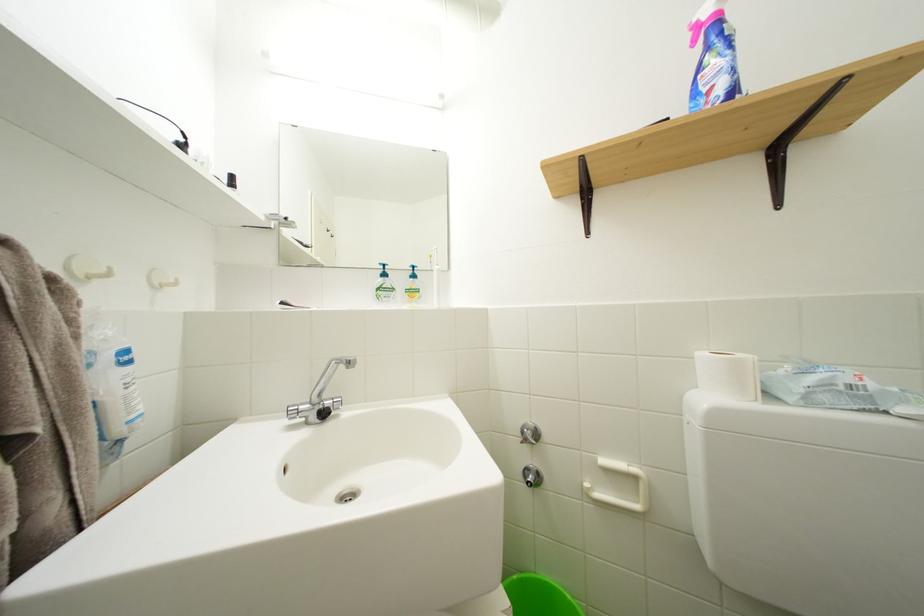
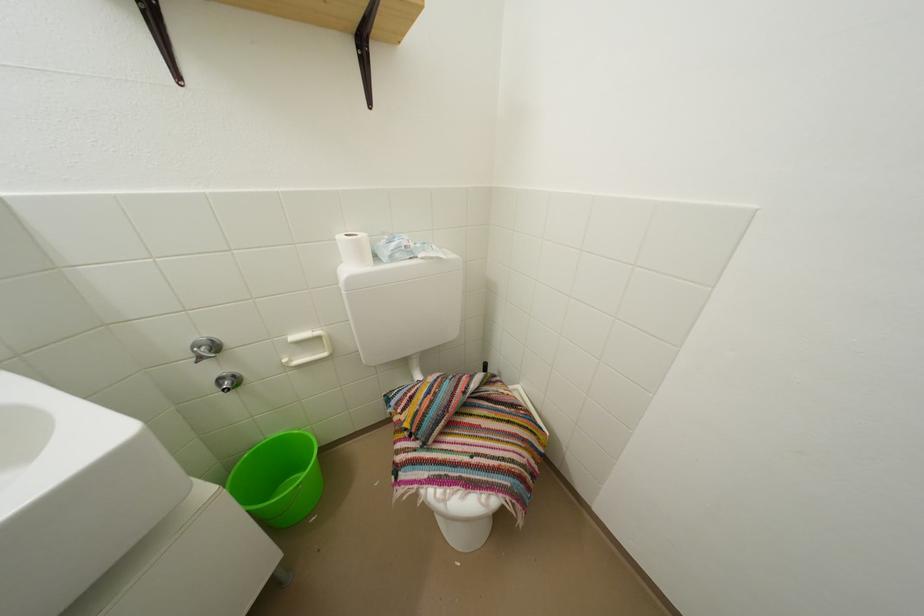
The first image is from the beginning of the video and the second image is from the end. How did the camera likely rotate when shooting the video?

The camera's rotation is toward right-down.